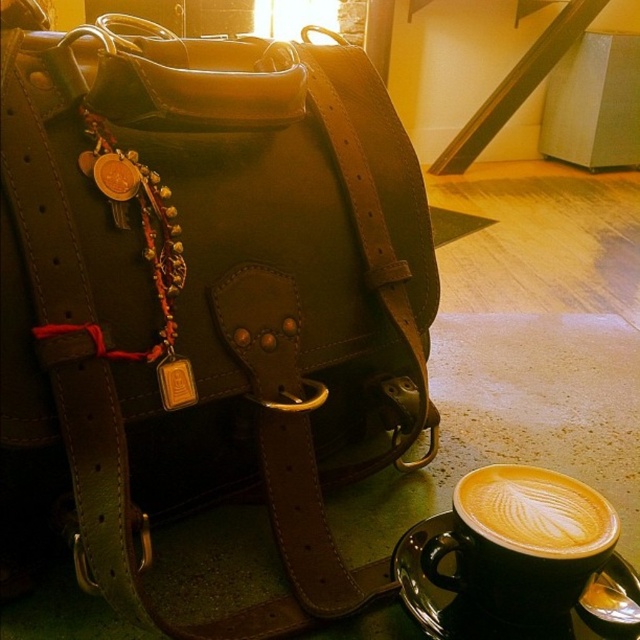
You are a barista preparing drinks and need to place a small decorative item on the table. The brown leather bag at center is already occupying space. Can you fit the cappuccino foam at lower right next to it without moving the bag?

The brown leather bag at center has a larger size compared to cappuccino foam at lower right, so there should be enough space to place the cappuccino foam at lower right next to the bag without moving it.

You are a delivery person who needs to place a small package on the table. The package is 10 cm wide. The table has limited space between the brown leather bag at center and the golden frothy latte at lower right. Can you fit the package between them?

The brown leather bag at center is closer to the viewer than the golden frothy latte at lower right, so the space between them might be sufficient to fit the 10 cm wide package. However, without exact distance measurements, it is uncertain. The answer depends on the actual spacing between the two objects.

You are a barista preparing drinks and see the golden frothy latte at lower right and the cappuccino foam at lower right. Which one is above the other?

The cappuccino foam at lower right is above the golden frothy latte at lower right because the golden frothy latte at lower right is positioned under it.